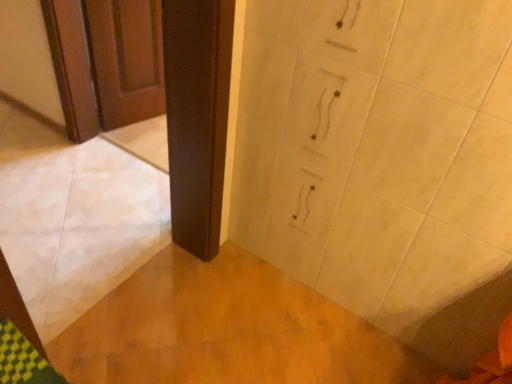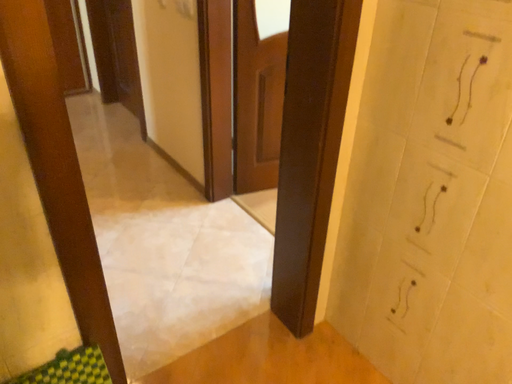
Question: Which way did the camera rotate in the video?

Choices:
 (A) rotated left
 (B) rotated right

Answer: (A)